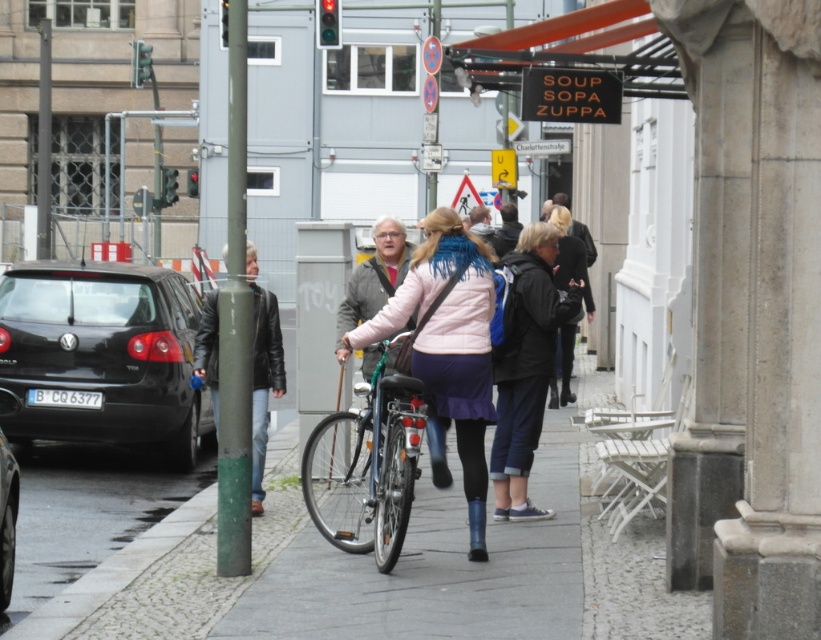
You are a delivery person trying to park your bicycle on the sidewalk. The bicycle requires 2 meters of space. Is there enough space on the paved stone sidewalk at center to park the bicycle without blocking the black matte car at left?

The paved stone sidewalk at center is positioned under the black matte car at left, which means the car is directly above it. Since the sidewalk is under the car, there might not be enough space to park the bicycle there without blocking the car. However, the description does not provide exact measurements of the sidewalk width. Without knowing the sidewalk width, it is impossible to determine if there is sufficient space for the bicycle.

You are standing on the paved stone sidewalk at center. What are the coordinates of your current position?

The coordinates of the paved stone sidewalk at center are at point (369, 573).